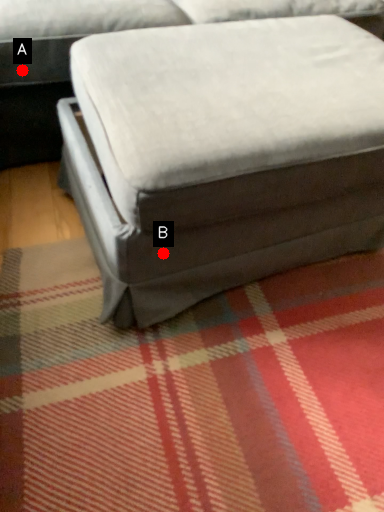
Question: Two points are circled on the image, labeled by A and B beside each circle. Which point is farther to the camera?

Choices:
 (A) A is further
 (B) B is further

Answer: (A)